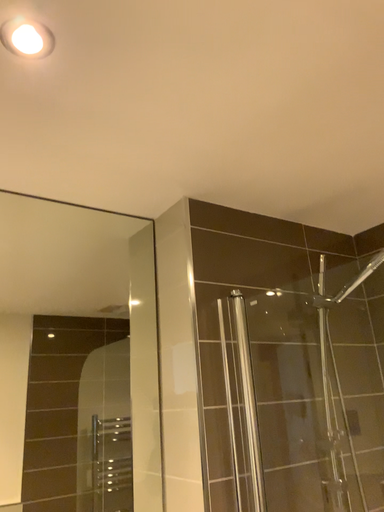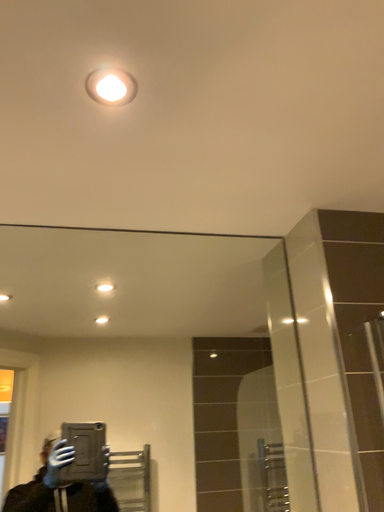
Question: How did the camera likely rotate when shooting the video?

Choices:
 (A) rotated right
 (B) rotated left

Answer: (B)